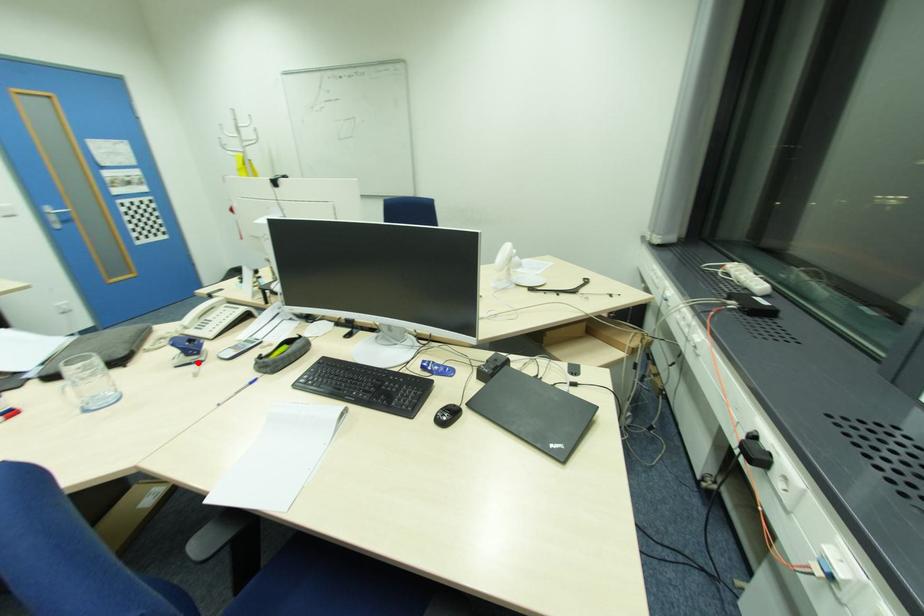
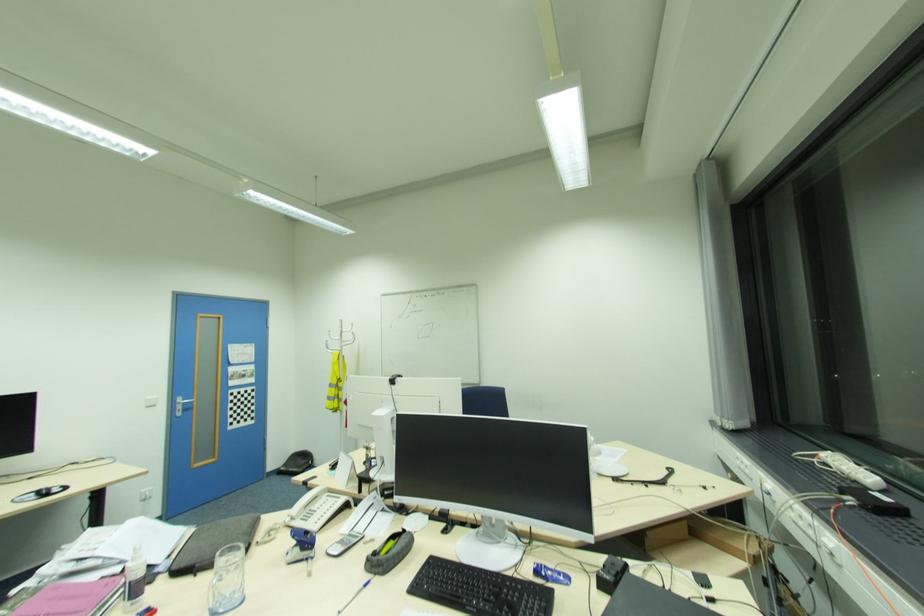
The point at the highlighted location is marked in the first image. Where is the corresponding point in the second image?

(310, 559)